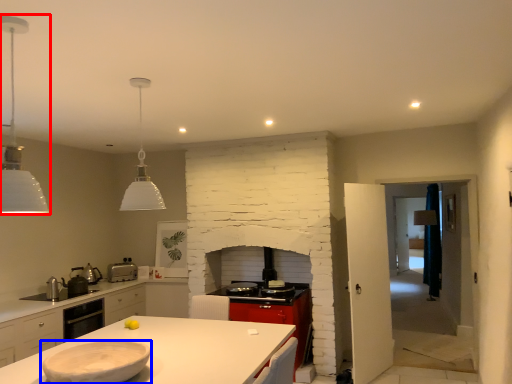
Question: Which object appears farthest to the camera in this image, light fixture (highlighted by a red box) or tableware (highlighted by a blue box)?

Choices:
 (A) light fixture
 (B) tableware

Answer: (B)